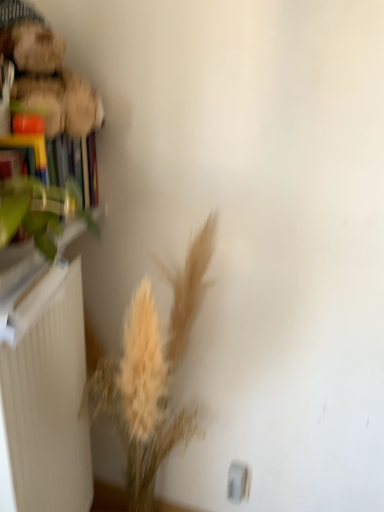
Question: Looking at their shapes, would you say light beige dried grass at lower left is wider or thinner than white matte radiator at left?

Choices:
 (A) wide
 (B) thin

Answer: (A)

Question: Is light beige dried grass at lower left bigger or smaller than white matte radiator at left?

Choices:
 (A) small
 (B) big

Answer: (B)

Question: Which object is positioned farthest from the white matte radiator at left?

Choices:
 (A) light beige dried grass at lower left
 (B) green leafy plant at left
 (C) hardcover book at left

Answer: (C)

Question: Which is farther from the green leafy plant at left?

Choices:
 (A) hardcover book at left
 (B) light beige dried grass at lower left
 (C) white matte radiator at left

Answer: (B)